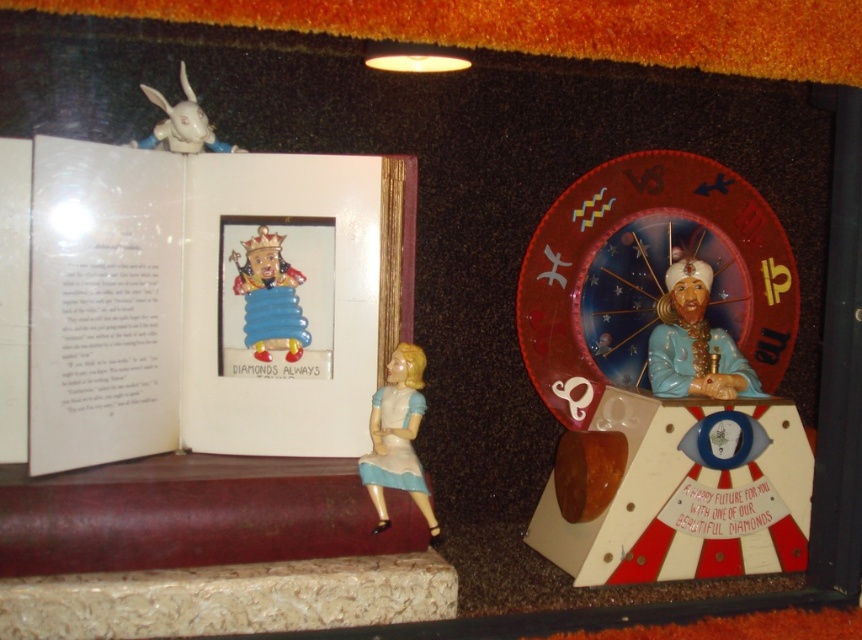
Question: Which object is farther from the camera taking this photo?

Choices:
 (A) matte plastic doll at center
 (B) matte blue plastic figure at center-right

Answer: (B)

Question: Can you confirm if matte plastic doll at center is wider than white glossy rabbit at upper left?

Choices:
 (A) yes
 (B) no

Answer: (B)

Question: Which point is closer to the camera?

Choices:
 (A) shiny plastic king at center
 (B) matte blue plastic figure at center-right
 (C) matte plastic book at left

Answer: (C)

Question: Which of the following is the farthest from the observer?

Choices:
 (A) (210, 132)
 (B) (261, 426)

Answer: (A)

Question: Is matte plastic book at left below white glossy rabbit at upper left?

Choices:
 (A) no
 (B) yes

Answer: (B)

Question: Does matte blue plastic figure at center-right appear on the left side of white glossy rabbit at upper left?

Choices:
 (A) yes
 (B) no

Answer: (B)